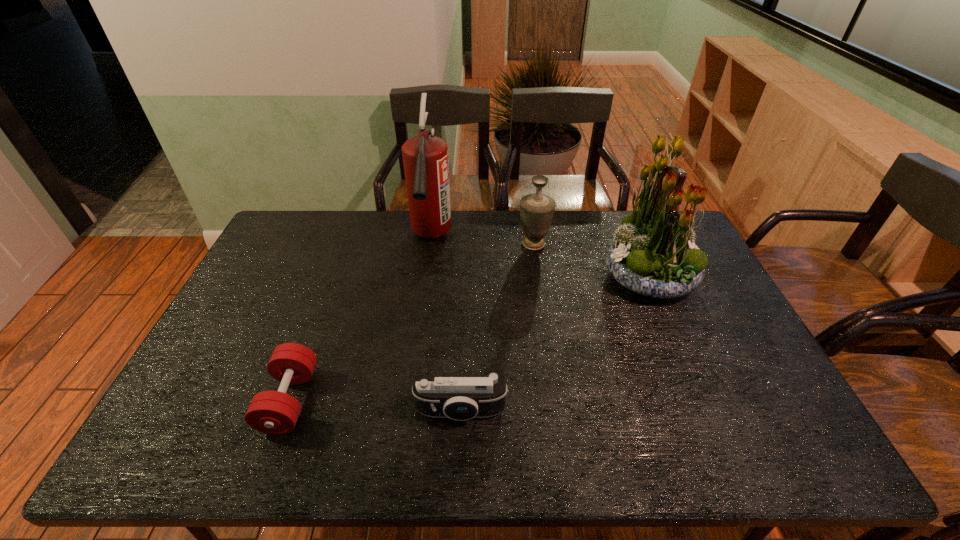
In the image, there is a desktop. Where is `free space at the far edge`? The width and height of the screenshot is (960, 540). free space at the far edge is located at coordinates (460, 232).

Identify the location of free location at the near edge of the desktop. The image size is (960, 540). (699, 455).

In the image, there is a desktop. At what (x,y) coordinates should I click in order to perform the action: click on free region at the left edge. Please return your answer as a coordinate pair (x, y). The image size is (960, 540). Looking at the image, I should click on (187, 397).

Identify the location of vacant point at the right edge. (747, 425).

Identify the location of blank area at the near left corner. (195, 435).

This screenshot has width=960, height=540. Find the location of `vacant space at the near right corner of the desktop`. vacant space at the near right corner of the desktop is located at coordinates (773, 451).

The width and height of the screenshot is (960, 540). Identify the location of vacant space that is in between the leftmost object and the fire extinguisher. (x=360, y=319).

Locate an element on the screen. The width and height of the screenshot is (960, 540). vacant area that lies between the flower arrangement and the fourth tallest object is located at coordinates (555, 345).

Locate an element on the screen. This screenshot has width=960, height=540. free space between the flower arrangement and the third shortest object is located at coordinates (591, 261).

Where is `vacant area that lies between the dumbbell and the second shortest object`? This screenshot has width=960, height=540. vacant area that lies between the dumbbell and the second shortest object is located at coordinates (375, 406).